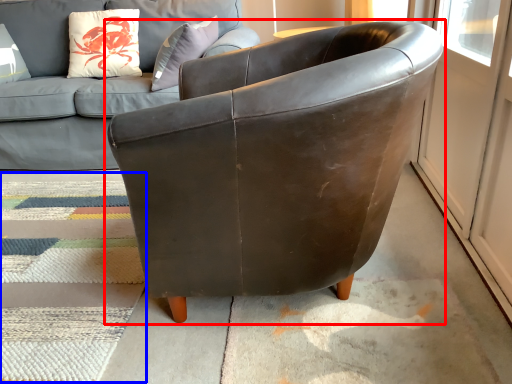
Question: Among these objects, which one is nearest to the camera, chair (highlighted by a red box) or mat (highlighted by a blue box)?

Choices:
 (A) chair
 (B) mat

Answer: (A)